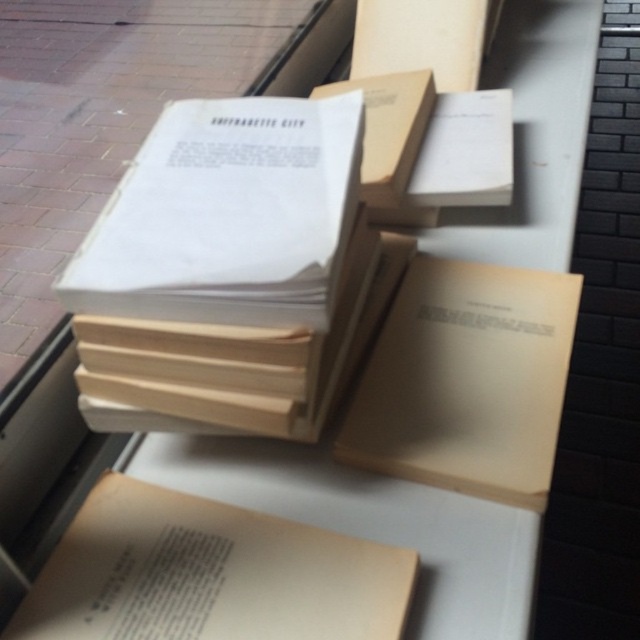
You are organizing books on a shelf and have two books to place. The beige paper book at lower left and the beige matte book at center. If you want to arrange them from smallest to largest, which order should you place them?

The beige paper book at lower left is smaller than the beige matte book at center, so you should place the beige paper book at lower left first followed by the beige matte book at center.

You are organizing books on a shelf and need to know their sizes. Which one is shorter between the beige paper book at lower left and the beige matte book at center?

The beige paper book at lower left is shorter than the beige matte book at center.